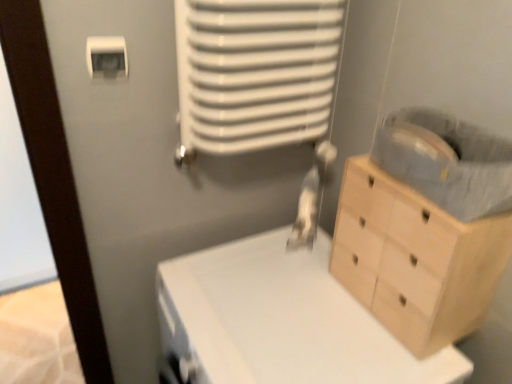
Question: Considering the positions of white matte changing table at center and light wood chest of drawers at right in the image, is white matte changing table at center taller or shorter than light wood chest of drawers at right?

Choices:
 (A) tall
 (B) short

Answer: (A)

Question: From a real-world perspective, relative to light wood chest of drawers at right, is white matte changing table at center vertically above or below?

Choices:
 (A) below
 (B) above

Answer: (A)

Question: Which of these objects is positioned farthest from the white plastic light switch at upper left?

Choices:
 (A) white matte changing table at center
 (B) light wood chest of drawers at right

Answer: (B)

Question: Estimate the real-world distances between objects in this image. Which object is closer to the light wood chest of drawers at right?

Choices:
 (A) white plastic light switch at upper left
 (B) white matte changing table at center

Answer: (B)